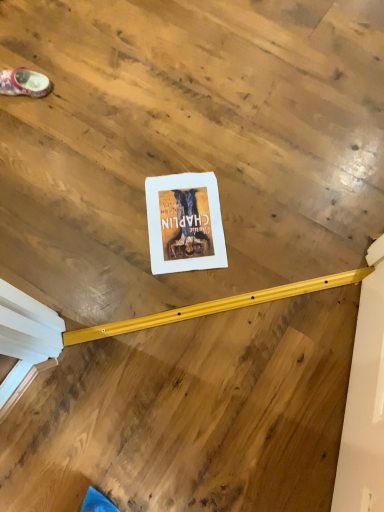
Locate an element on the screen. The width and height of the screenshot is (384, 512). free space between white paper at center and matte pink fabric slipper at upper left is located at coordinates coord(101,154).